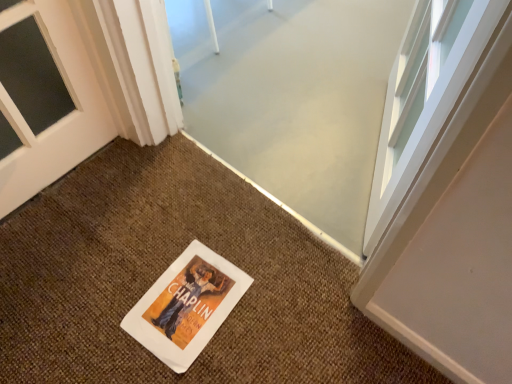
At what (x,y) coordinates should I click in order to perform the action: click on free region under white paper flyer at center (from a real-world perspective). Please return your answer as a coordinate pair (x, y). This screenshot has width=512, height=384. Looking at the image, I should click on (192, 299).